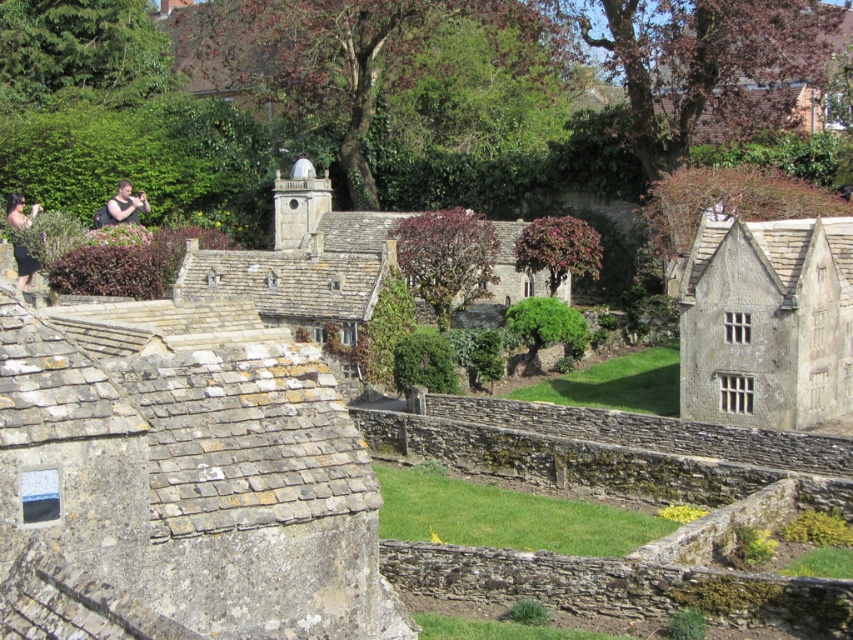
Question: Which point is farther from the camera taking this photo?

Choices:
 (A) (117, 221)
 (B) (21, 275)

Answer: (A)

Question: Can you confirm if matte black dress at left is positioned above matte black shirt at upper left?

Choices:
 (A) no
 (B) yes

Answer: (A)

Question: Is matte black dress at left below matte black shirt at upper left?

Choices:
 (A) yes
 (B) no

Answer: (A)

Question: Where is matte black dress at left located in relation to matte black shirt at upper left in the image?

Choices:
 (A) right
 (B) left

Answer: (B)

Question: Among these objects, which one is nearest to the camera?

Choices:
 (A) matte black dress at left
 (B) matte black shirt at upper left

Answer: (A)

Question: Which object is closer to the camera taking this photo?

Choices:
 (A) matte black dress at left
 (B) matte black shirt at upper left

Answer: (A)